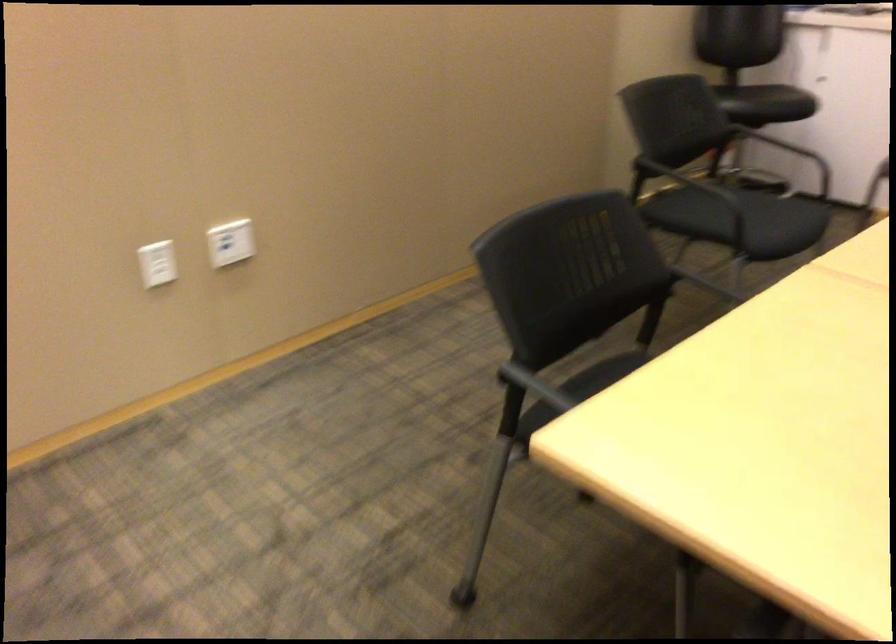
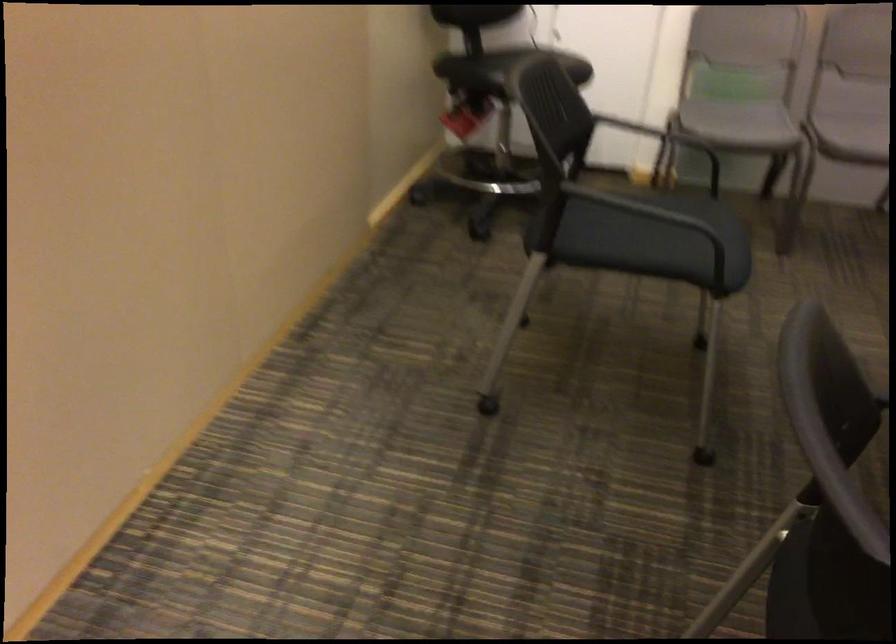
In the second image, find the point that corresponds to [624,380] in the first image.

(826, 585)